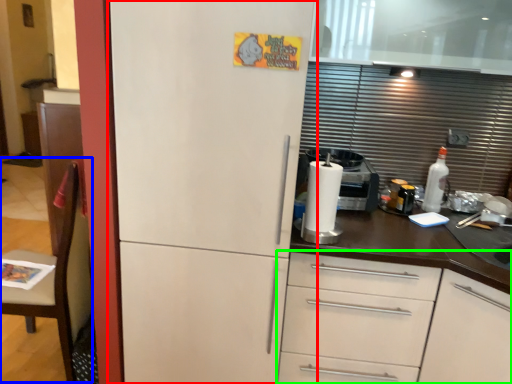
Question: Based on their relative distances, which object is farther from refrigerator (highlighted by a red box)? Choose from chair (highlighted by a blue box) and cabinetry (highlighted by a green box).

Choices:
 (A) chair
 (B) cabinetry

Answer: (A)